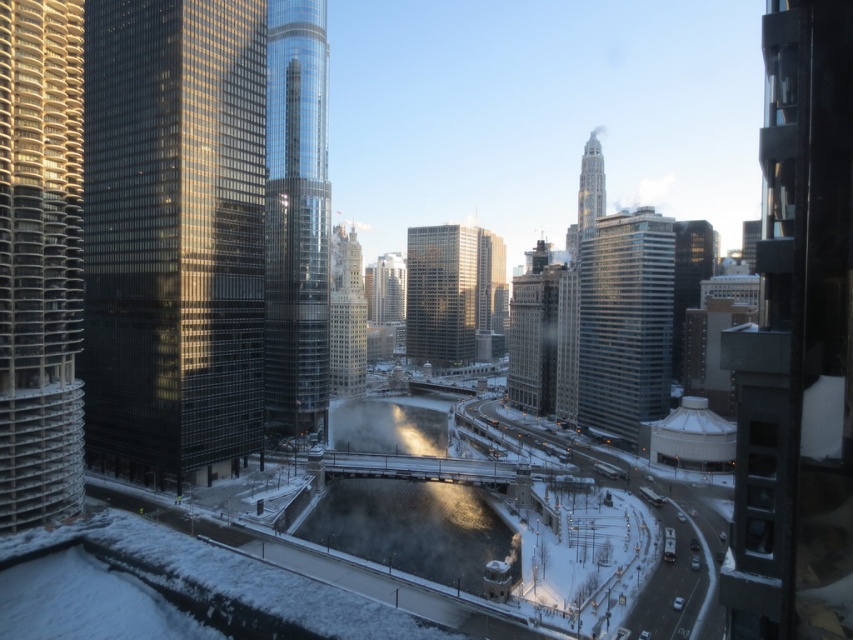
Question: Among these objects, which one is farthest from the camera?

Choices:
 (A) silver glass skyscraper at upper right
 (B) reflective glass skyscraper at center
 (C) black glass tower at right
 (D) glassy reflective skyscraper at center

Answer: (B)

Question: Is shiny glass skyscraper at center positioned before silver glass skyscraper at center?

Choices:
 (A) no
 (B) yes

Answer: (B)

Question: Which point is farther to the camera?

Choices:
 (A) glassy reflective skyscraper at center
 (B) silver glass skyscraper at upper right

Answer: (B)

Question: Does silver metallic tower at left have a larger size compared to silver glass skyscraper at upper right?

Choices:
 (A) no
 (B) yes

Answer: (A)

Question: Which of the following is the farthest from the observer?

Choices:
 (A) (595, 170)
 (B) (654, 330)
 (C) (828, 12)
 (D) (231, 177)

Answer: (A)

Question: Observing the image, what is the correct spatial positioning of silver metallic tower at left in reference to silver glass skyscraper at upper right?

Choices:
 (A) above
 (B) below

Answer: (B)